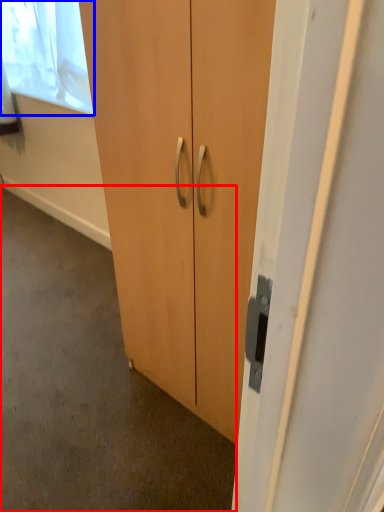
Question: Which point is further to the camera, concrete (highlighted by a red box) or window screen (highlighted by a blue box)?

Choices:
 (A) concrete
 (B) window screen

Answer: (B)